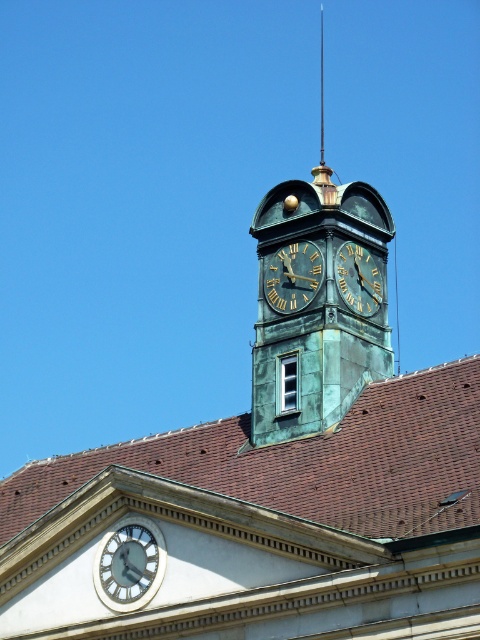
Which is behind, point (271, 269) or point (290, 269)?

Point (271, 269)

Locate an element on the screen. This screenshot has width=480, height=640. green patina clock tower at center is located at coordinates (317, 301).

Is point (299, 397) positioned after point (297, 276)?

No, it is not.

Identify the location of green patina clock tower at center. (317, 301).

Which is in front, point (315, 188) or point (323, 138)?

Point (315, 188) is in front.

Is the position of green patina clock tower at center less distant than that of polished brass spire at center?

Yes, it is.

Is point (289, 349) in front of point (314, 170)?

Yes.

Find the location of a particular element. The image size is (480, 640). green patina clock tower at center is located at coordinates (317, 301).

Based on the photo, does brown tile roof at center appear over goldmaterial/textureclock at upper center?

No, brown tile roof at center is not above goldmaterial/textureclock at upper center.

Does brown tile roof at center have a smaller size compared to goldmaterial/textureclock at upper center?

Actually, brown tile roof at center might be larger than goldmaterial/textureclock at upper center.

This screenshot has height=640, width=480. What are the coordinates of `brown tile roof at center` in the screenshot? It's located at (309, 461).

In order to click on brown tile roof at center in this screenshot , I will do `click(309, 461)`.